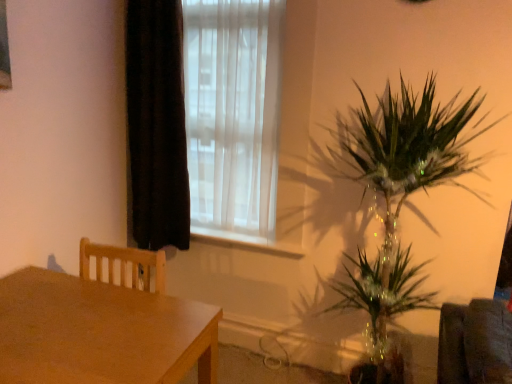
You are a GUI agent. You are given a task and a screenshot of the screen. Output one action in this format:
    pyautogui.click(x=<x>, y=<y>)
    Task: Click on the vacant point above wooden table at left (from a real-world perspective)
    The height and width of the screenshot is (384, 512).
    Given the screenshot: What is the action you would take?
    pyautogui.click(x=75, y=320)